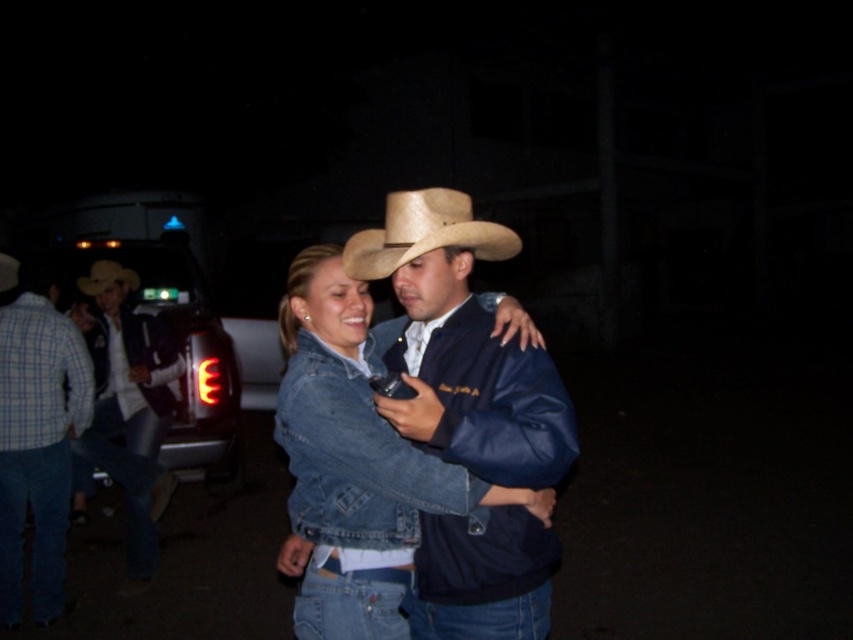
Question: Does brushed metal truck at left have a smaller size compared to brushed metal cowboy hat at left?

Choices:
 (A) yes
 (B) no

Answer: (B)

Question: Which of the following is the closest to the observer?

Choices:
 (A) (108, 435)
 (B) (386, 268)

Answer: (B)

Question: Does straw hat at center appear on the right side of light brown straw cowboy hat at center?

Choices:
 (A) yes
 (B) no

Answer: (A)

Question: Which point is farther to the camera?

Choices:
 (A) light brown straw cowboy hat at center
 (B) brushed metal cowboy hat at left
 (C) straw hat at center
 (D) brushed metal truck at left

Answer: (A)

Question: Does matte blue jacket at center have a greater width compared to brushed metal truck at left?

Choices:
 (A) no
 (B) yes

Answer: (A)

Question: Which point is farther to the camera?

Choices:
 (A) light brown straw cowboy hat at center
 (B) plaid cotton shirt at left
 (C) brushed metal cowboy hat at left
 (D) matte blue jacket at center

Answer: (A)